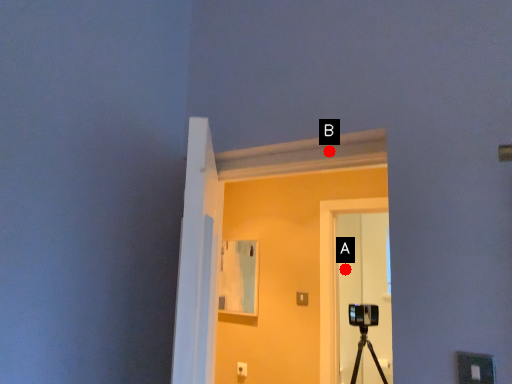
Question: Two points are circled on the image, labeled by A and B beside each circle. Which point is farther to the camera?

Choices:
 (A) A is further
 (B) B is further

Answer: (A)